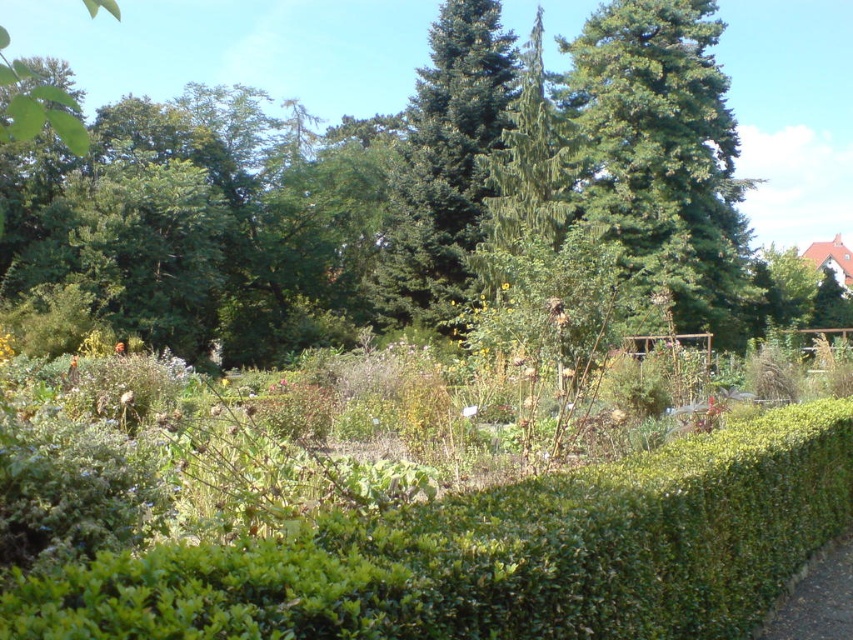
Does green needle-like at upper center have a larger size compared to dirt path at lower right?

Indeed, green needle-like at upper center has a larger size compared to dirt path at lower right.

Is point (624, 19) farther from viewer compared to point (840, 589)?

Yes, point (624, 19) is farther from viewer.

What are the coordinates of `green needle-like at upper center` in the screenshot? It's located at (663, 156).

Which is behind, point (672, 604) or point (706, 259)?

The point (706, 259) is behind.

Can you confirm if green leafy hedge at lower right is smaller than green needle-like at upper center?

Yes, green leafy hedge at lower right is smaller than green needle-like at upper center.

Is point (258, 579) in front of point (683, 154)?

That is True.

Find the location of `green leafy hedge at lower right`. green leafy hedge at lower right is located at coordinates (498, 554).

Who is higher up, green leafy hedge at lower right or green needle-like at center?

green needle-like at center

Does green leafy hedge at lower right have a lesser width compared to green needle-like at center?

Correct, green leafy hedge at lower right's width is less than green needle-like at center's.

Between point (323, 566) and point (509, 60), which one is positioned behind?

Point (509, 60)

Where is `green leafy hedge at lower right`? The image size is (853, 640). green leafy hedge at lower right is located at coordinates (498, 554).